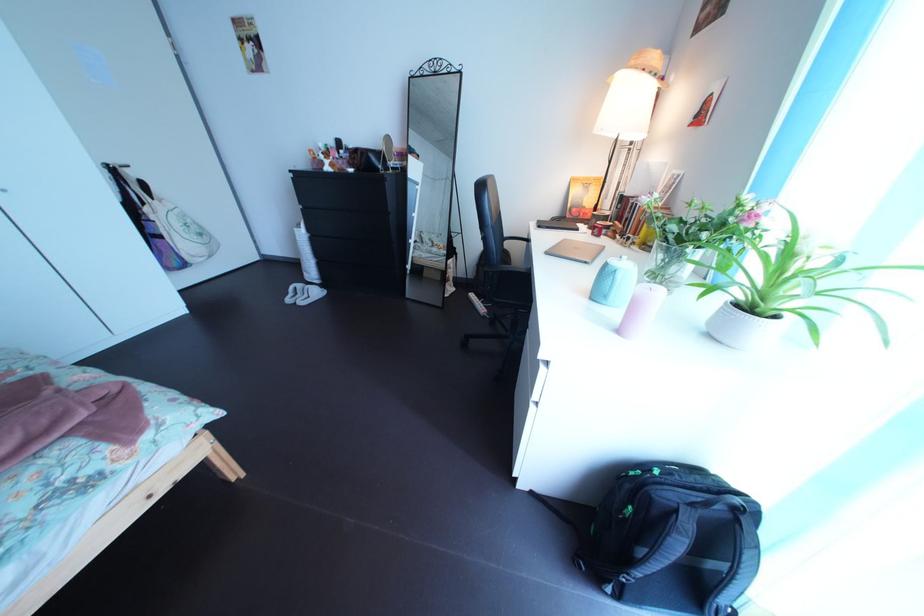
Locate an element on the screen. The height and width of the screenshot is (616, 924). red power switch is located at coordinates (707, 105).